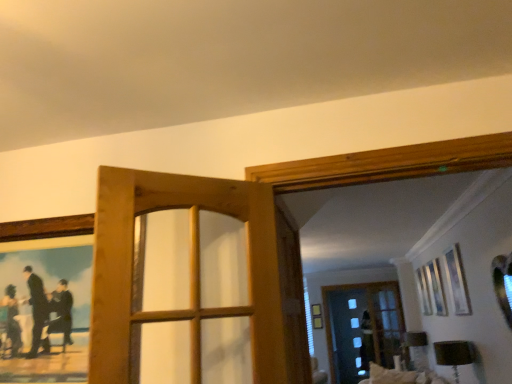
Question: Can you confirm if wooden door at center is wider than wooden picture frame at upper left?

Choices:
 (A) no
 (B) yes

Answer: (B)

Question: Can wooden picture frame at upper left be found inside wooden door at center?

Choices:
 (A) yes
 (B) no

Answer: (B)

Question: Is wooden door at center at the left side of wooden picture frame at upper left?

Choices:
 (A) yes
 (B) no

Answer: (B)

Question: Is wooden door at center thinner than wooden picture frame at upper left?

Choices:
 (A) yes
 (B) no

Answer: (B)

Question: From a real-world perspective, is wooden door at center on wooden picture frame at upper left?

Choices:
 (A) yes
 (B) no

Answer: (A)

Question: In terms of height, does transparent glass screen door at center look taller or shorter compared to wooden door at center?

Choices:
 (A) tall
 (B) short

Answer: (A)

Question: In the image, is transparent glass screen door at center on the left side or the right side of wooden door at center?

Choices:
 (A) right
 (B) left

Answer: (A)

Question: Does point (279, 215) appear closer or farther from the camera than point (183, 188)?

Choices:
 (A) farther
 (B) closer

Answer: (A)

Question: Considering the positions of transparent glass screen door at center and wooden door at center in the image, is transparent glass screen door at center bigger or smaller than wooden door at center?

Choices:
 (A) big
 (B) small

Answer: (A)

Question: From the image's perspective, is wooden picture frame at upper left located above or below transparent glass screen door at center?

Choices:
 (A) below
 (B) above

Answer: (B)

Question: From their relative heights in the image, would you say wooden picture frame at upper left is taller or shorter than transparent glass screen door at center?

Choices:
 (A) short
 (B) tall

Answer: (A)

Question: Considering the relative positions of wooden picture frame at upper left and transparent glass screen door at center in the image provided, is wooden picture frame at upper left to the left or to the right of transparent glass screen door at center?

Choices:
 (A) left
 (B) right

Answer: (A)

Question: Is wooden picture frame at upper left situated inside transparent glass screen door at center or outside?

Choices:
 (A) inside
 (B) outside

Answer: (B)

Question: Considering the positions of wooden picture frame at upper left and wooden door at center in the image, is wooden picture frame at upper left wider or thinner than wooden door at center?

Choices:
 (A) wide
 (B) thin

Answer: (B)

Question: Based on their sizes in the image, would you say wooden picture frame at upper left is bigger or smaller than wooden door at center?

Choices:
 (A) small
 (B) big

Answer: (A)